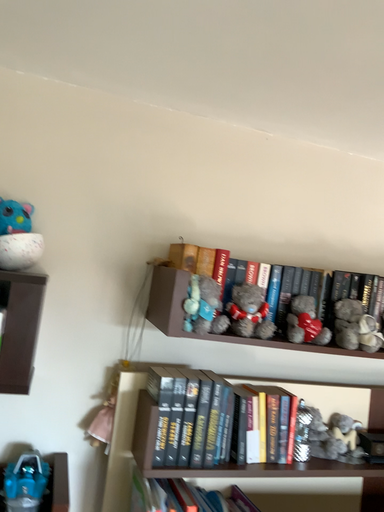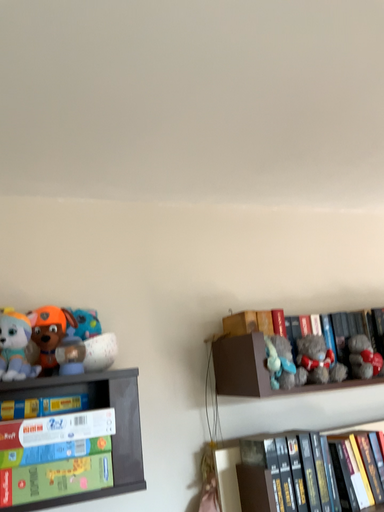
Question: How did the camera likely rotate when shooting the video?

Choices:
 (A) rotated upward
 (B) rotated downward

Answer: (A)